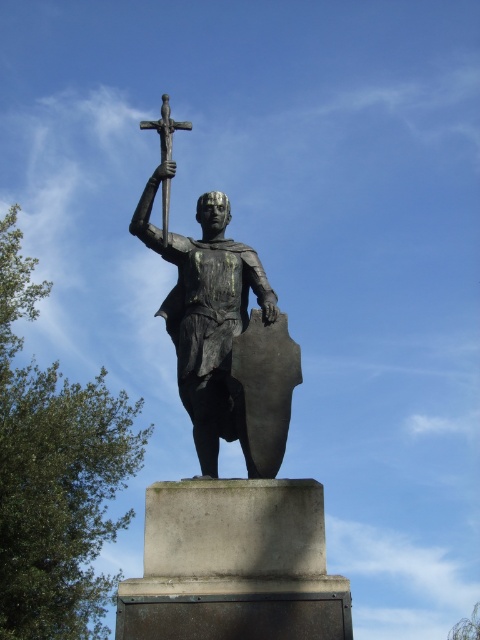
Question: Is bronze statue at center to the right of polished bronze cross at upper center from the viewer's perspective?

Choices:
 (A) no
 (B) yes

Answer: (B)

Question: Which object appears farthest from the camera in this image?

Choices:
 (A) bronze statue at center
 (B) polished bronze cross at upper center

Answer: (B)

Question: Is bronze statue at center smaller than polished bronze cross at upper center?

Choices:
 (A) yes
 (B) no

Answer: (A)

Question: Can you confirm if bronze statue at center is positioned below polished bronze cross at upper center?

Choices:
 (A) yes
 (B) no

Answer: (A)